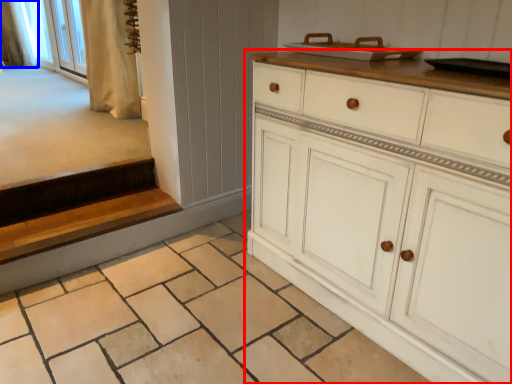
Question: Which point is closer to the camera, chest of drawers (highlighted by a red box) or curtain (highlighted by a blue box)?

Choices:
 (A) chest of drawers
 (B) curtain

Answer: (A)